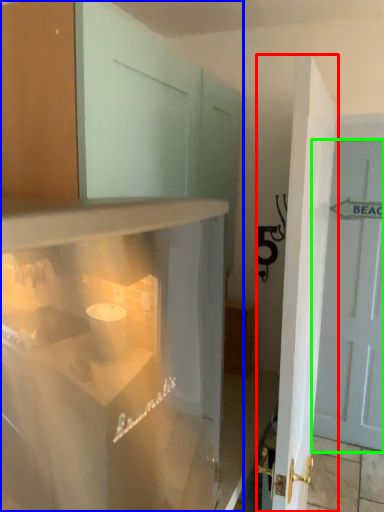
Question: Based on their relative distances, which object is nearer to door (highlighted by a red box)? Choose from cabinetry (highlighted by a blue box) and door (highlighted by a green box).

Choices:
 (A) cabinetry
 (B) door

Answer: (A)